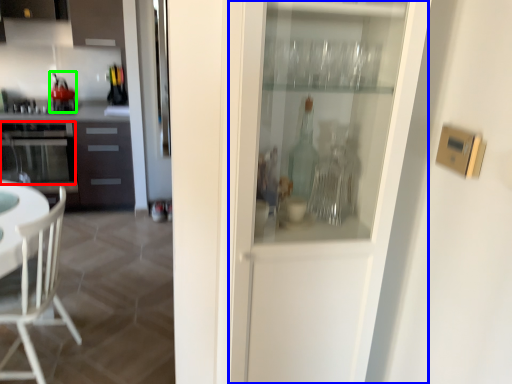
Question: Estimate the real-world distances between objects in this image. Which object is farther from oven (highlighted by a red box), screen door (highlighted by a blue box) or appliance (highlighted by a green box)?

Choices:
 (A) screen door
 (B) appliance

Answer: (A)